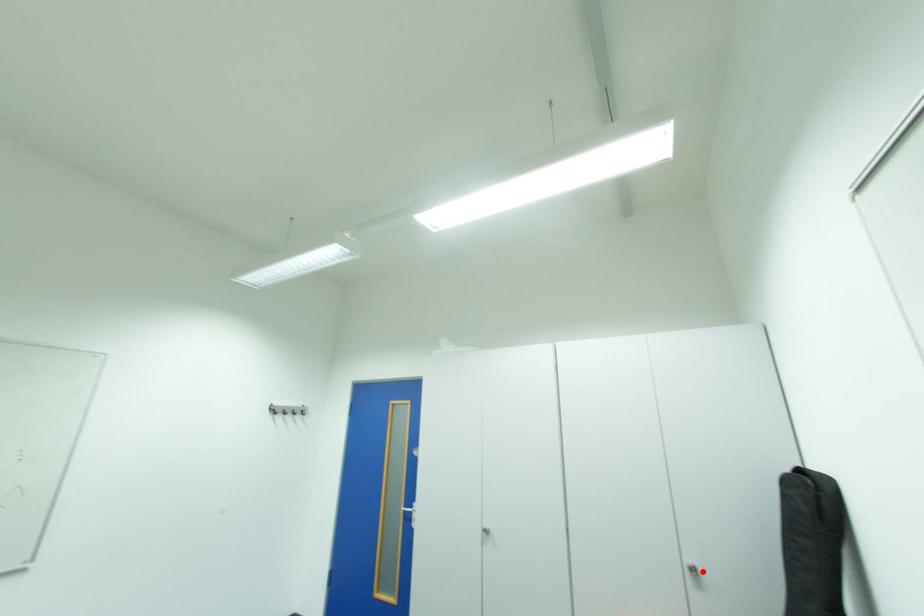
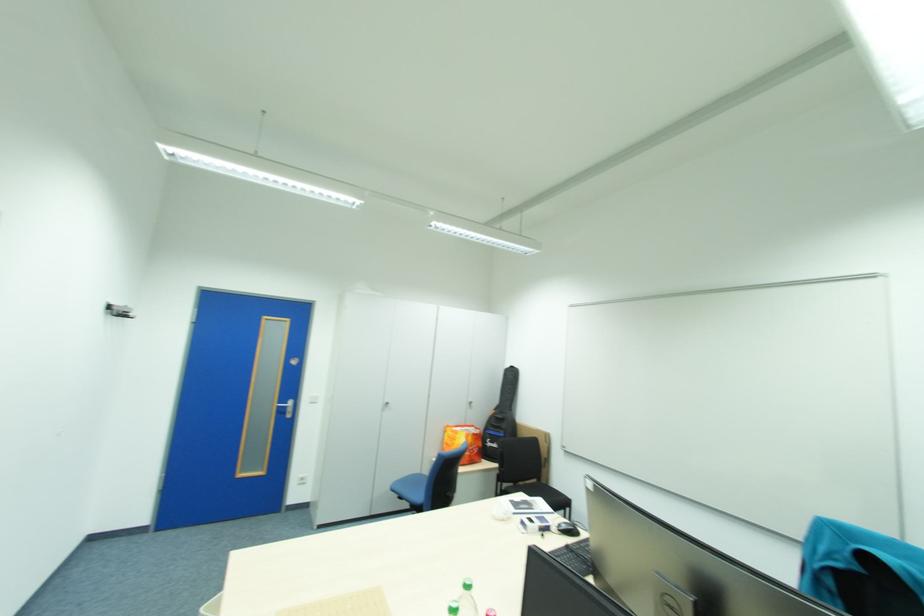
Locate, in the second image, the point that corresponds to the highlighted location in the first image.

(479, 403)